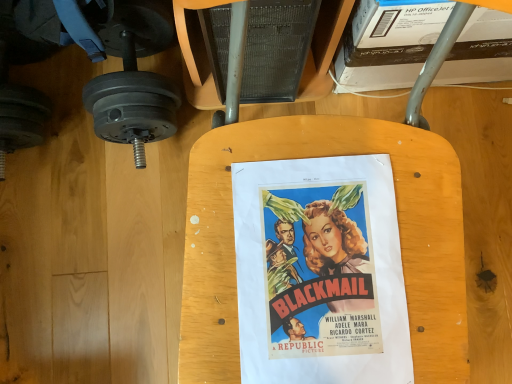
Question: Is vibrant paper poster at center bigger or smaller than matte black dumbbell at left?

Choices:
 (A) small
 (B) big

Answer: (A)

Question: Is vibrant paper poster at center to the left or to the right of matte black dumbbell at left in the image?

Choices:
 (A) left
 (B) right

Answer: (B)

Question: Is point (366, 294) closer or farther from the camera than point (139, 110)?

Choices:
 (A) closer
 (B) farther

Answer: (A)

Question: Is point (138, 39) positioned closer to the camera than point (267, 213)?

Choices:
 (A) farther
 (B) closer

Answer: (A)

Question: Is matte black dumbbell at left in front of or behind vibrant paper poster at center in the image?

Choices:
 (A) front
 (B) behind

Answer: (B)

Question: Is matte black dumbbell at left bigger or smaller than vibrant paper poster at center?

Choices:
 (A) small
 (B) big

Answer: (B)

Question: In terms of width, does matte black dumbbell at left look wider or thinner when compared to vibrant paper poster at center?

Choices:
 (A) thin
 (B) wide

Answer: (B)